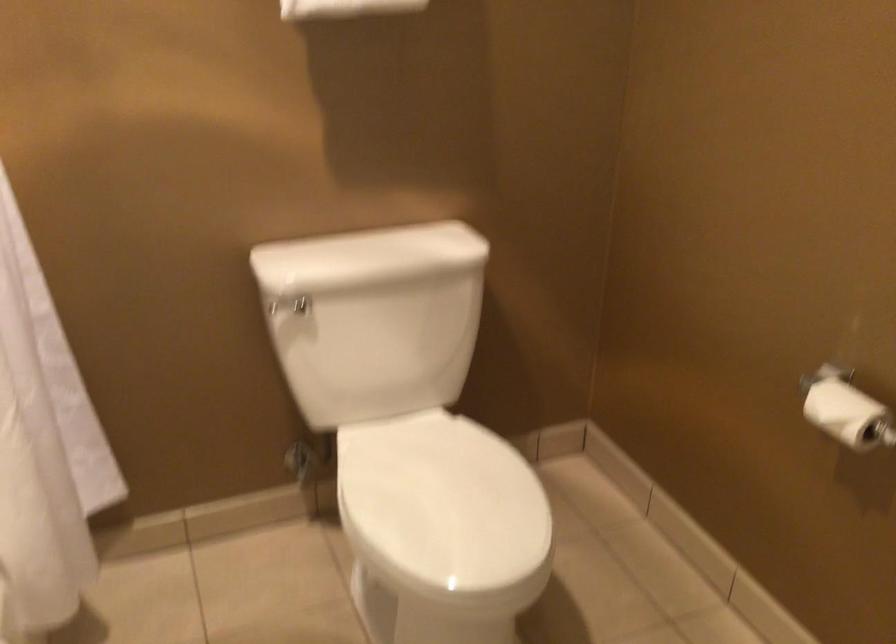
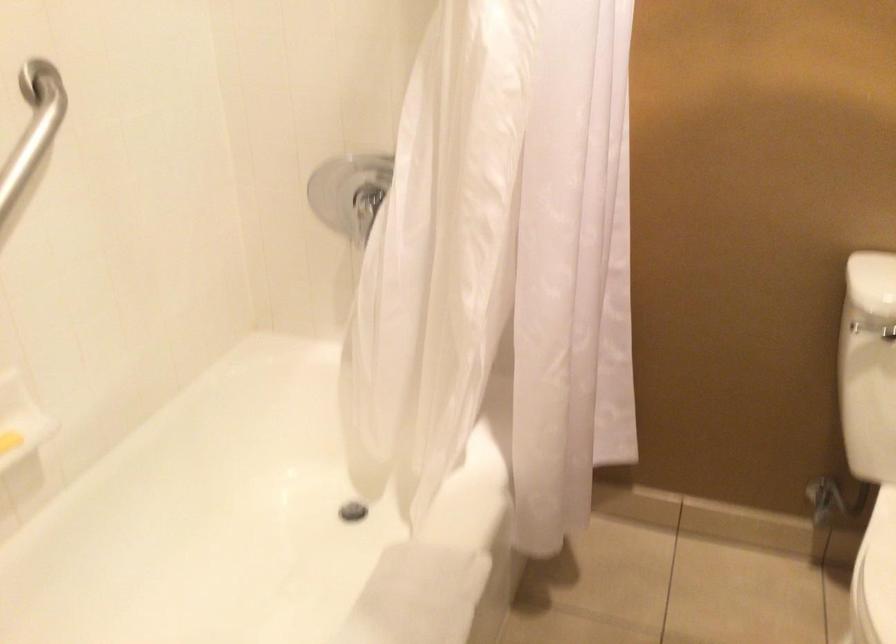
Question: The first image is from the beginning of the video and the second image is from the end. How did the camera likely rotate when shooting the video?

Choices:
 (A) Left
 (B) Right
 (C) Up
 (D) Down

Answer: (A)